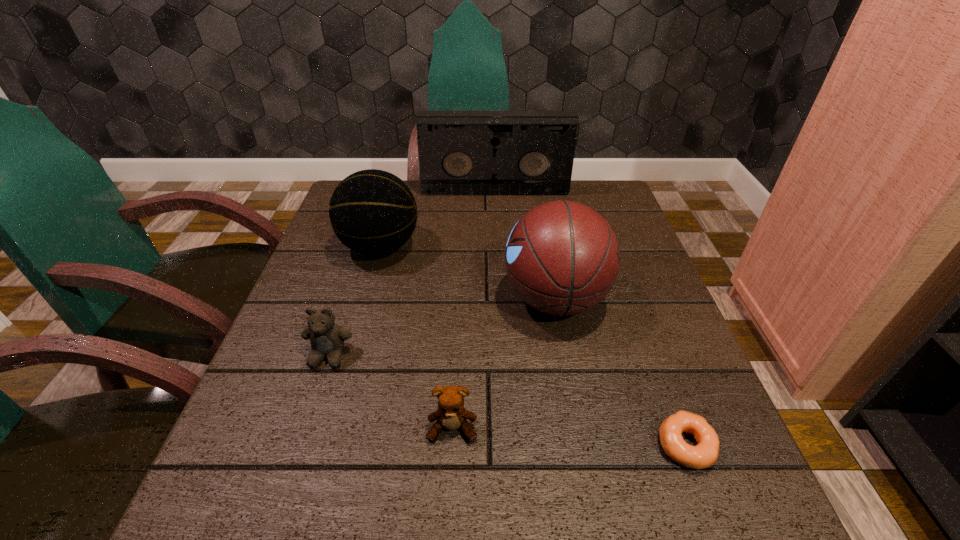
Identify the location of videotape. (460, 152).

You are a GUI agent. You are given a task and a screenshot of the screen. Output one action in this format:
    pyautogui.click(x=<x>, y=<y>)
    Task: Click on the right basketball
    This screenshot has width=960, height=540.
    Given the screenshot: What is the action you would take?
    pyautogui.click(x=562, y=257)

Find the location of a particular element. the left basketball is located at coordinates (373, 212).

Find the location of a particular element. The image size is (960, 540). the third shortest object is located at coordinates (327, 338).

The width and height of the screenshot is (960, 540). Find the location of `the farther teddy bear`. the farther teddy bear is located at coordinates (327, 338).

This screenshot has width=960, height=540. Identify the location of the nearer teddy bear. (451, 414).

Find the location of `the fifth tallest object`. the fifth tallest object is located at coordinates (451, 414).

This screenshot has height=540, width=960. I want to click on the shortest object, so click(703, 455).

In order to click on doughnut in this screenshot , I will do `click(703, 455)`.

Find the location of a particular element. The width and height of the screenshot is (960, 540). free location located on the front side of the videotape is located at coordinates [497, 228].